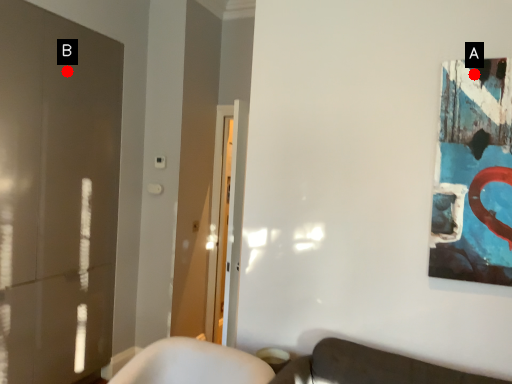
Question: Two points are circled on the image, labeled by A and B beside each circle. Which point is closer to the camera taking this photo?

Choices:
 (A) A is closer
 (B) B is closer

Answer: (A)